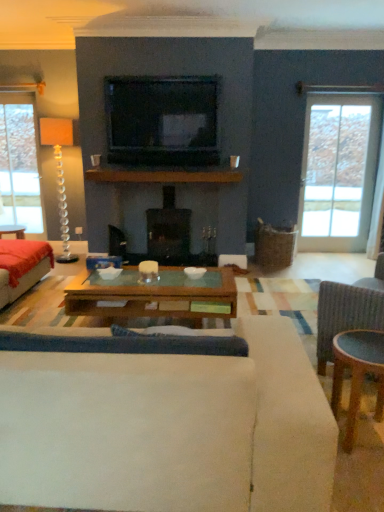
Question: Does clear glass door at right have a lesser width compared to velvet red couch at left, which appears as the first studio couch when viewed from the back?

Choices:
 (A) no
 (B) yes

Answer: (B)

Question: Is clear glass door at right oriented away from velvet red couch at left, acting as the 1th studio couch starting from the left?

Choices:
 (A) no
 (B) yes

Answer: (A)

Question: Is clear glass door at right positioned behind velvet red couch at left, acting as the 1th studio couch starting from the left?

Choices:
 (A) no
 (B) yes

Answer: (B)

Question: From the image's perspective, is clear glass door at right over velvet red couch at left, placed as the second studio couch when sorted from right to left?

Choices:
 (A) no
 (B) yes

Answer: (B)

Question: Would you say velvet red couch at left, placed as the second studio couch when sorted from right to left, is part of clear glass door at right's contents?

Choices:
 (A) yes
 (B) no

Answer: (B)

Question: Considering the relative sizes of clear glass door at right and velvet red couch at left, acting as the 1th studio couch starting from the left, in the image provided, is clear glass door at right wider than velvet red couch at left, acting as the 1th studio couch starting from the left,?

Choices:
 (A) yes
 (B) no

Answer: (B)

Question: Is wooden glass coffee table at center behind black glass fireplace at center?

Choices:
 (A) no
 (B) yes

Answer: (A)

Question: Is wooden glass coffee table at center directly adjacent to black glass fireplace at center?

Choices:
 (A) no
 (B) yes

Answer: (A)

Question: Would you consider wooden glass coffee table at center to be distant from black glass fireplace at center?

Choices:
 (A) no
 (B) yes

Answer: (B)

Question: Does wooden glass coffee table at center come in front of black glass fireplace at center?

Choices:
 (A) yes
 (B) no

Answer: (A)

Question: Is wooden glass coffee table at center aimed at black glass fireplace at center?

Choices:
 (A) no
 (B) yes

Answer: (A)

Question: From the image's perspective, is wooden glass coffee table at center over black glass fireplace at center?

Choices:
 (A) yes
 (B) no

Answer: (B)

Question: Is wooden glass coffee table at center aimed at black glossy television at upper center?

Choices:
 (A) yes
 (B) no

Answer: (B)